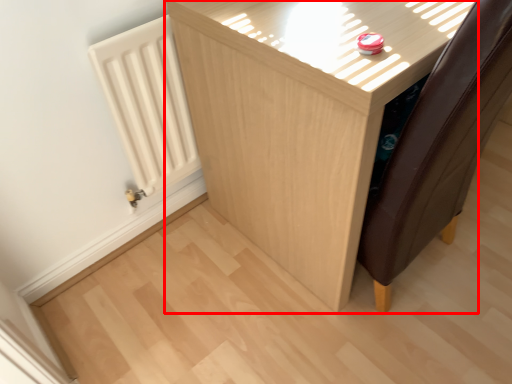
Question: From the image's perspective, where is furniture (annotated by the red box) located relative to radiator?

Choices:
 (A) above
 (B) below

Answer: (A)